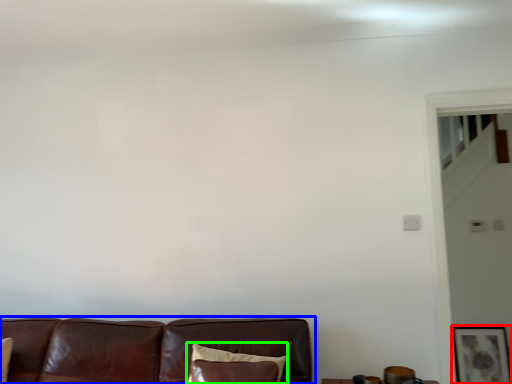
Question: Based on their relative distances, which object is nearer to picture frame (highlighted by a red box)? Choose from studio couch (highlighted by a blue box) and pillow (highlighted by a green box).

Choices:
 (A) studio couch
 (B) pillow

Answer: (A)